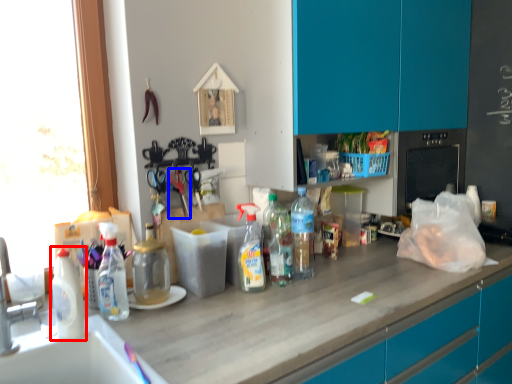
Question: Which object is closer to the camera taking this photo, bottle (highlighted by a red box) or scissors (highlighted by a blue box)?

Choices:
 (A) bottle
 (B) scissors

Answer: (A)